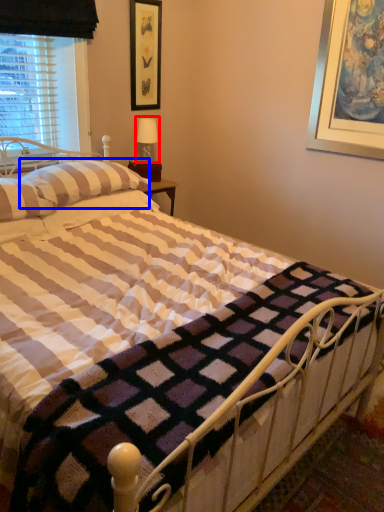
Question: Which point is further to the camera, table lamp (highlighted by a red box) or pillow (highlighted by a blue box)?

Choices:
 (A) table lamp
 (B) pillow

Answer: (A)